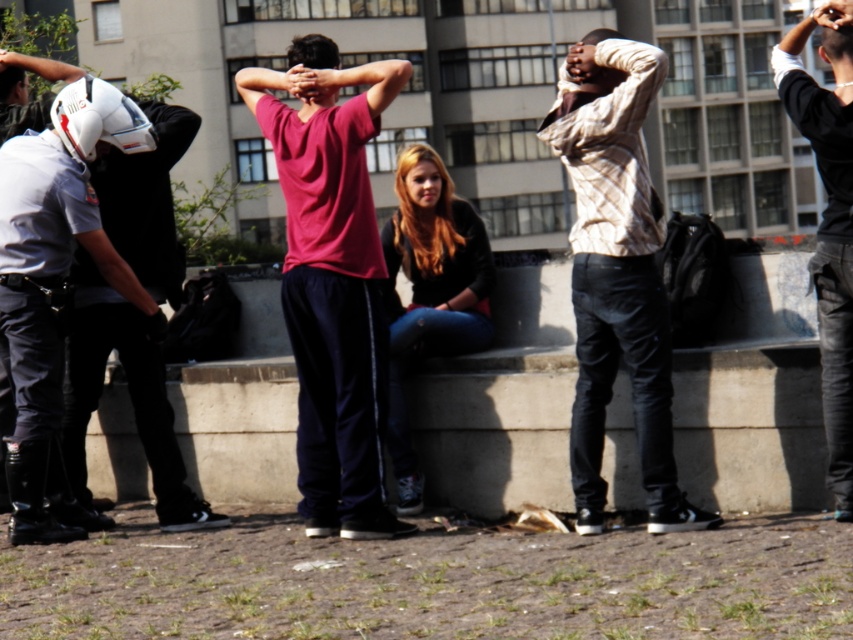
You are a photographer trying to capture a clear shot of both the white matte helmet at left and the dark brown leather jacket at center. Since you want both items to be in focus, which one should you adjust your camera focus on first?

The white matte helmet at left is closer to you than the dark brown leather jacket at center, so you should focus on the white matte helmet at left first to ensure both are in focus.

You are a photographer trying to capture a photo of the dark brown leather jacket at center and the black leather jacket at right. Since you want both jackets in the frame, which jacket should you position your camera closer to in order to include both?

Since the dark brown leather jacket at center is to the left of black leather jacket at right, you should position your camera closer to the dark brown leather jacket at center to ensure both jackets are included in the frame.

You are a photographer trying to capture a candid shot of the dark brown leather jacket at center without including the white matte helmet at left in the frame. Based on their positions, is this possible?

The white matte helmet at left is below the dark brown leather jacket at center, so if you position your camera to focus on the upper part of the jacket, you can avoid including the helmet in the shot.